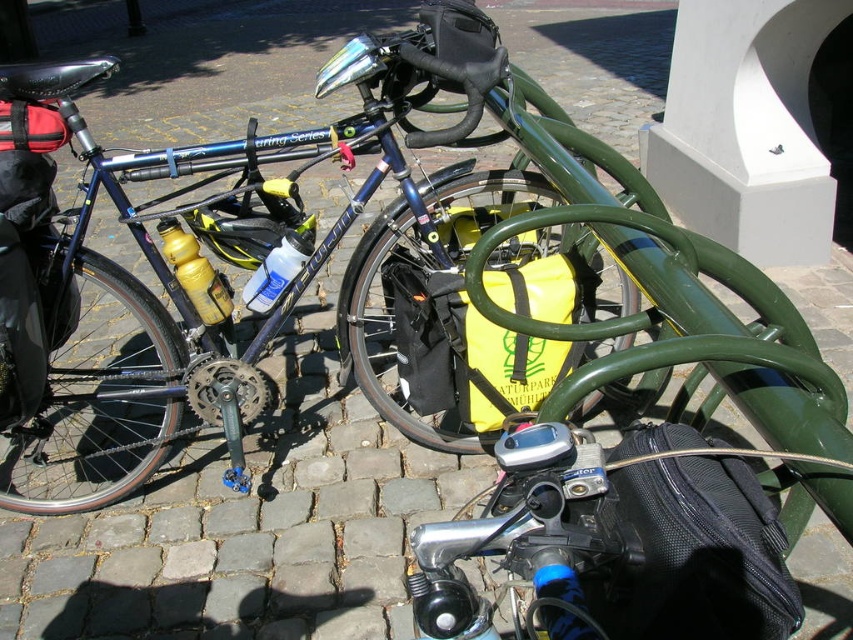
How much distance is there between black mesh bag at lower right and yellow matte bag at center?

black mesh bag at lower right is 1.03 meters from yellow matte bag at center.

Does black mesh bag at lower right appear over yellow matte bag at center?

No, black mesh bag at lower right is not above yellow matte bag at center.

In order to click on black mesh bag at lower right in this screenshot , I will do `click(701, 552)`.